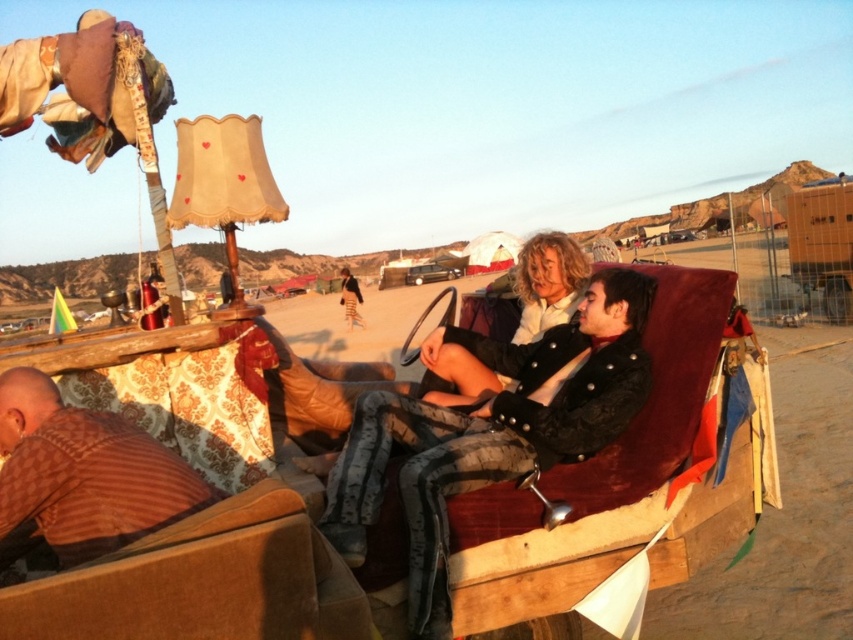
Question: In this image, where is velvet red couch at center located relative to matte black jacket at center?

Choices:
 (A) right
 (B) left

Answer: (A)

Question: Does velvet red couch at center come behind velvet black jacket at center?

Choices:
 (A) no
 (B) yes

Answer: (B)

Question: Which point is farther to the camera?

Choices:
 (A) (619, 330)
 (B) (105, 474)
 (C) (554, 256)

Answer: (C)

Question: Which object is farther from the camera taking this photo?

Choices:
 (A) brown striped shirt at lower left
 (B) matte black jacket at center

Answer: (B)

Question: Does velvet red couch at center come in front of brown striped shirt at lower left?

Choices:
 (A) no
 (B) yes

Answer: (A)

Question: Which object is positioned farthest from the velvet black jacket at center?

Choices:
 (A) matte black jacket at center
 (B) velvet red couch at center
 (C) brown striped shirt at lower left

Answer: (C)